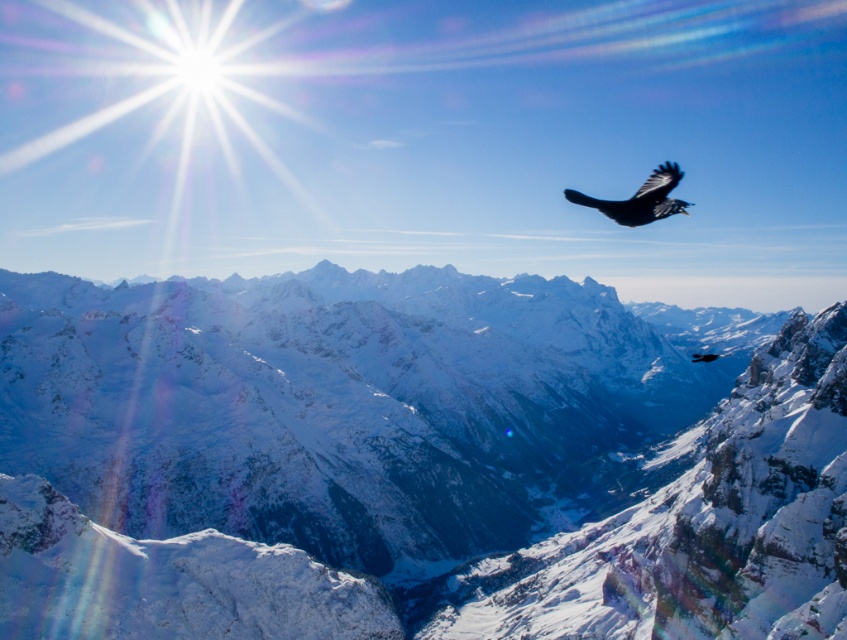
Does snowy granite mountain range at center appear under shiny black bird at upper right?

Indeed, snowy granite mountain range at center is positioned under shiny black bird at upper right.

Can you confirm if snowy granite mountain range at center is positioned above shiny black bird at upper right?

No, snowy granite mountain range at center is not above shiny black bird at upper right.

Image resolution: width=847 pixels, height=640 pixels. What do you see at coordinates (410, 461) in the screenshot? I see `snowy granite mountain range at center` at bounding box center [410, 461].

Locate an element on the screen. This screenshot has height=640, width=847. snowy granite mountain range at center is located at coordinates (410, 461).